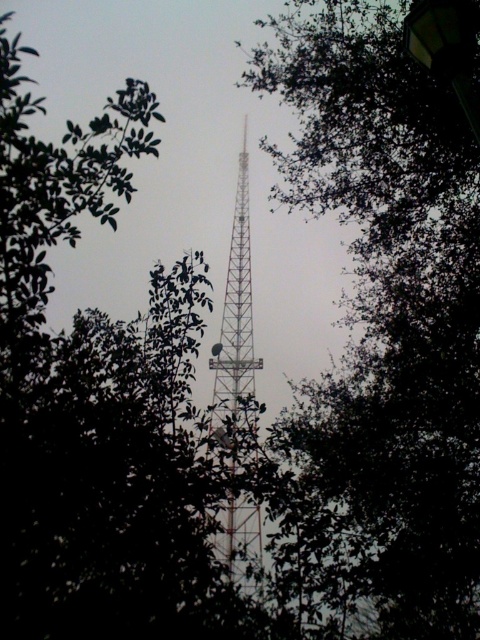
Question: Does green leafy tree at center appear on the left side of metallic lattice tower at center?

Choices:
 (A) yes
 (B) no

Answer: (B)

Question: Considering the relative positions of green leafy tree at center and metallic lattice tower at center in the image provided, where is green leafy tree at center located with respect to metallic lattice tower at center?

Choices:
 (A) above
 (B) below

Answer: (B)

Question: Which of the following is the farthest from the observer?

Choices:
 (A) green leafy tree at center
 (B) metallic lattice tower at center

Answer: (B)

Question: Is green leafy tree at center positioned in front of metallic lattice tower at center?

Choices:
 (A) yes
 (B) no

Answer: (A)